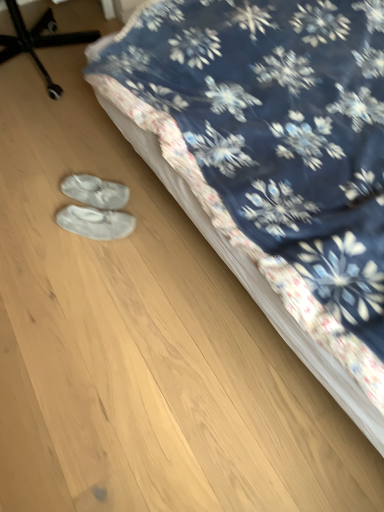
In order to face floral fabric bed at center, should I rotate leftwards or rightwards?

To face it directly, rotate right by 26.180 degrees.

Image resolution: width=384 pixels, height=512 pixels. I want to click on white fabric shoe covers at lower left, arranged as the second footwear when ordered from the bottom, so click(96, 191).

Choose the correct answer: Is white fabric shoe covers at lower left, arranged as the second footwear when ordered from the bottom, inside floral fabric bed at center or outside it?

white fabric shoe covers at lower left, arranged as the second footwear when ordered from the bottom, lies outside floral fabric bed at center.

From the image's perspective, is white fabric shoe covers at lower left, arranged as the second footwear when ordered from the bottom, positioned above or below floral fabric bed at center?

Clearly, from the image's perspective, white fabric shoe covers at lower left, arranged as the second footwear when ordered from the bottom, is below floral fabric bed at center.

Is white fabric shoe covers at lower left, which ranks as the first footwear in top-to-bottom order, positioned with its back to floral fabric bed at center?

Yes, white fabric shoe covers at lower left, which ranks as the first footwear in top-to-bottom order, is facing away from floral fabric bed at center.

Which is correct: black plastic chair at upper left is inside white fabric shoe covers at lower left, which ranks as the first footwear in top-to-bottom order, or outside of it?

black plastic chair at upper left lies outside white fabric shoe covers at lower left, which ranks as the first footwear in top-to-bottom order.

Is black plastic chair at upper left thinner than white fabric shoe covers at lower left, arranged as the second footwear when ordered from the bottom?

Incorrect, the width of black plastic chair at upper left is not less than that of white fabric shoe covers at lower left, arranged as the second footwear when ordered from the bottom.

Considering the points (48, 75) and (102, 195), which point is in front, point (48, 75) or point (102, 195)?

Positioned in front is point (102, 195).

This screenshot has height=512, width=384. Find the location of `furniture located behind the floral fabric bed at center`. furniture located behind the floral fabric bed at center is located at coordinates (39, 41).

Considering their positions, is floral fabric bed at center located in front of or behind black plastic chair at upper left?

Clearly, floral fabric bed at center is in front of black plastic chair at upper left.

Considering the relative sizes of floral fabric bed at center and black plastic chair at upper left in the image provided, is floral fabric bed at center shorter than black plastic chair at upper left?

No, floral fabric bed at center is not shorter than black plastic chair at upper left.

Looking at this image, between floral fabric bed at center and black plastic chair at upper left, which one has larger width?

floral fabric bed at center is wider.

Looking at this image, how different are the orientations of floral fabric bed at center and white fabric shoe covers at lower left, arranged as the second footwear when ordered from the bottom, in degrees?

The facing directions of floral fabric bed at center and white fabric shoe covers at lower left, arranged as the second footwear when ordered from the bottom, are 44.1 degrees apart.

From a real-world perspective, is floral fabric bed at center physically located above or below white fabric shoe covers at lower left, which ranks as the first footwear in top-to-bottom order?

From a real-world perspective, floral fabric bed at center is physically above white fabric shoe covers at lower left, which ranks as the first footwear in top-to-bottom order.

Based on the photo, is floral fabric bed at center not within white fabric shoe covers at lower left, which ranks as the first footwear in top-to-bottom order?

Yes.

Does floral fabric bed at center appear on the left side of white fabric shoe covers at lower left, arranged as the second footwear when ordered from the bottom?

Incorrect, floral fabric bed at center is not on the left side of white fabric shoe covers at lower left, arranged as the second footwear when ordered from the bottom.

From the image's perspective, is floral fabric bed at center above or below white suede slippers at lower center, which is the second footwear from top to bottom?

Clearly, from the image's perspective, floral fabric bed at center is above white suede slippers at lower center, which is the second footwear from top to bottom.

Could you measure the distance between floral fabric bed at center and white suede slippers at lower center, which is the second footwear from top to bottom?

They are 23.22 inches apart.

Considering the relative sizes of floral fabric bed at center and white suede slippers at lower center, the first footwear from the bottom, in the image provided, is floral fabric bed at center taller than white suede slippers at lower center, the first footwear from the bottom,?

Correct, floral fabric bed at center is much taller as white suede slippers at lower center, the first footwear from the bottom.

Is floral fabric bed at center in front of or behind white suede slippers at lower center, the first footwear from the bottom, in the image?

Visually, floral fabric bed at center is located in front of white suede slippers at lower center, the first footwear from the bottom.

Considering the sizes of objects black plastic chair at upper left and white suede slippers at lower center, the first footwear from the bottom, in the image provided, who is bigger, black plastic chair at upper left or white suede slippers at lower center, the first footwear from the bottom,?

black plastic chair at upper left is bigger.

Which is closer, (53, 20) or (113, 233)?

Point (53, 20) is positioned farther from the camera compared to point (113, 233).

From the image's perspective, is black plastic chair at upper left above or below white suede slippers at lower center, which is the second footwear from top to bottom?

From the image's perspective, black plastic chair at upper left appears above white suede slippers at lower center, which is the second footwear from top to bottom.

Would you say black plastic chair at upper left is outside white suede slippers at lower center, which is the second footwear from top to bottom?

Absolutely, black plastic chair at upper left is external to white suede slippers at lower center, which is the second footwear from top to bottom.

Who is bigger, white suede slippers at lower center, the first footwear from the bottom, or white fabric shoe covers at lower left, arranged as the second footwear when ordered from the bottom?

white fabric shoe covers at lower left, arranged as the second footwear when ordered from the bottom.

Considering the sizes of objects white suede slippers at lower center, which is the second footwear from top to bottom, and white fabric shoe covers at lower left, which ranks as the first footwear in top-to-bottom order, in the image provided, who is taller, white suede slippers at lower center, which is the second footwear from top to bottom, or white fabric shoe covers at lower left, which ranks as the first footwear in top-to-bottom order,?

white fabric shoe covers at lower left, which ranks as the first footwear in top-to-bottom order, is taller.

Relative to white fabric shoe covers at lower left, arranged as the second footwear when ordered from the bottom, is white suede slippers at lower center, which is the second footwear from top to bottom, in front or behind?

white suede slippers at lower center, which is the second footwear from top to bottom, is in front of white fabric shoe covers at lower left, arranged as the second footwear when ordered from the bottom.

From a real-world perspective, is white suede slippers at lower center, which is the second footwear from top to bottom, beneath white fabric shoe covers at lower left, arranged as the second footwear when ordered from the bottom?

No, from a real-world perspective, white suede slippers at lower center, which is the second footwear from top to bottom, is not below white fabric shoe covers at lower left, arranged as the second footwear when ordered from the bottom.

Image resolution: width=384 pixels, height=512 pixels. I want to click on bed above the white fabric shoe covers at lower left, arranged as the second footwear when ordered from the bottom (from the image's perspective), so click(272, 162).

From the black plastic chair at upper left, count 1st footwear to the right and point to it. Please provide its 2D coordinates.

[(96, 191)]

Estimate the real-world distances between objects in this image. Which object is further from white fabric shoe covers at lower left, which ranks as the first footwear in top-to-bottom order, black plastic chair at upper left or floral fabric bed at center?

Among the two, black plastic chair at upper left is located further to white fabric shoe covers at lower left, which ranks as the first footwear in top-to-bottom order.

From the image, which object appears to be farther from white fabric shoe covers at lower left, arranged as the second footwear when ordered from the bottom, white suede slippers at lower center, which is the second footwear from top to bottom, or floral fabric bed at center?

Based on the image, floral fabric bed at center appears to be further to white fabric shoe covers at lower left, arranged as the second footwear when ordered from the bottom.

Looking at the image, which one is located closer to black plastic chair at upper left, white fabric shoe covers at lower left, arranged as the second footwear when ordered from the bottom, or floral fabric bed at center?

white fabric shoe covers at lower left, arranged as the second footwear when ordered from the bottom, is positioned closer to the anchor black plastic chair at upper left.

Considering their positions, is black plastic chair at upper left positioned closer to floral fabric bed at center than white suede slippers at lower center, which is the second footwear from top to bottom?

Based on the image, white suede slippers at lower center, which is the second footwear from top to bottom, appears to be nearer to floral fabric bed at center.

Considering their positions, is white suede slippers at lower center, the first footwear from the bottom, positioned closer to floral fabric bed at center than white fabric shoe covers at lower left, arranged as the second footwear when ordered from the bottom?

white suede slippers at lower center, the first footwear from the bottom, is closer to floral fabric bed at center.

Based on their spatial positions, is white suede slippers at lower center, the first footwear from the bottom, or floral fabric bed at center further from black plastic chair at upper left?

Among the two, floral fabric bed at center is located further to black plastic chair at upper left.

Consider the image. Estimate the real-world distances between objects in this image. Which object is further from white suede slippers at lower center, the first footwear from the bottom, floral fabric bed at center or white fabric shoe covers at lower left, arranged as the second footwear when ordered from the bottom?

floral fabric bed at center is positioned further to the anchor white suede slippers at lower center, the first footwear from the bottom.

When comparing their distances from white fabric shoe covers at lower left, arranged as the second footwear when ordered from the bottom, does black plastic chair at upper left or white suede slippers at lower center, the first footwear from the bottom, seem further?

Based on the image, black plastic chair at upper left appears to be further to white fabric shoe covers at lower left, arranged as the second footwear when ordered from the bottom.

Where is `footwear between black plastic chair at upper left and white suede slippers at lower center, the first footwear from the bottom, vertically`? This screenshot has height=512, width=384. footwear between black plastic chair at upper left and white suede slippers at lower center, the first footwear from the bottom, vertically is located at coordinates (96, 191).

Where is `footwear located between floral fabric bed at center and white fabric shoe covers at lower left, which ranks as the first footwear in top-to-bottom order, in the depth direction`? This screenshot has height=512, width=384. footwear located between floral fabric bed at center and white fabric shoe covers at lower left, which ranks as the first footwear in top-to-bottom order, in the depth direction is located at coordinates (96, 222).